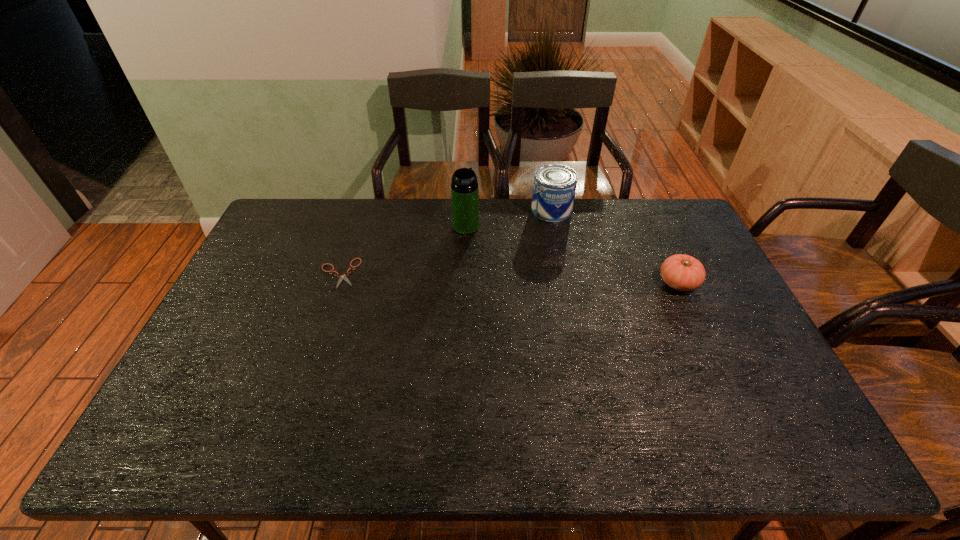
The width and height of the screenshot is (960, 540). Identify the location of free spot on the desktop that is between the leftmost object and the rightmost object and is positioned from the spout of the third object from right to left. (548, 279).

You are a GUI agent. You are given a task and a screenshot of the screen. Output one action in this format:
    pyautogui.click(x=<x>, y=<y>)
    Task: Click on the vacant spot on the desktop that is between the shortest object and the second shortest object and is positioned on the front label of the third shortest object
    
    Given the screenshot: What is the action you would take?
    pyautogui.click(x=538, y=279)